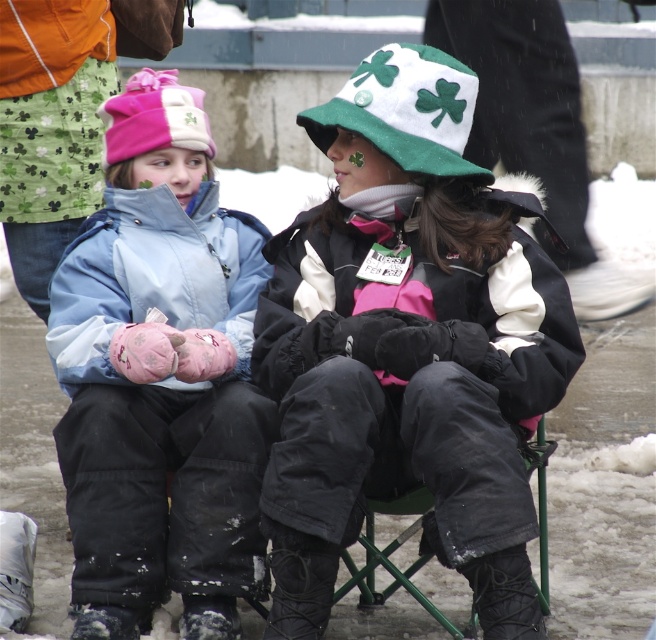
Question: Among these points, which one is nearest to the camera?

Choices:
 (A) (438, 451)
 (B) (106, 561)
 (C) (428, 492)

Answer: (A)

Question: Which of the following is the closest to the observer?

Choices:
 (A) green metal folding chair at lower center
 (B) white matte hat at center

Answer: (B)

Question: Estimate the real-world distances between objects in this image. Which object is closer to the green metal folding chair at lower center?

Choices:
 (A) matte blue jacket at center
 (B) white matte hat at center

Answer: (B)

Question: Does white matte hat at center appear on the right side of matte blue jacket at center?

Choices:
 (A) yes
 (B) no

Answer: (A)

Question: Can you confirm if white matte hat at center is positioned to the left of matte blue jacket at center?

Choices:
 (A) no
 (B) yes

Answer: (A)

Question: Is white matte hat at center smaller than matte blue jacket at center?

Choices:
 (A) yes
 (B) no

Answer: (B)